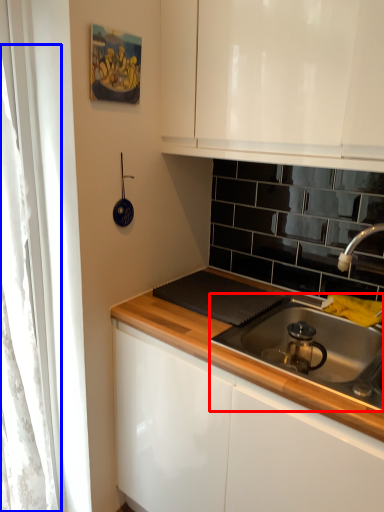
Question: Which object is further to the camera taking this photo, gas stove (highlighted by a red box) or curtain (highlighted by a blue box)?

Choices:
 (A) gas stove
 (B) curtain

Answer: (B)